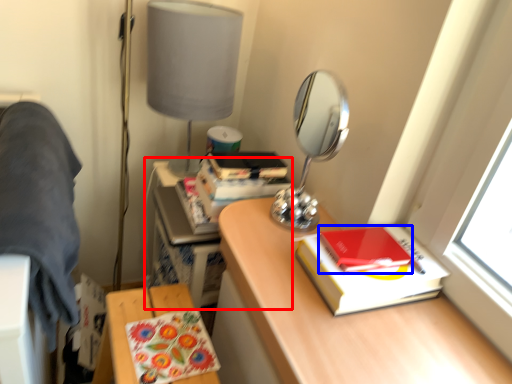
Question: Which object appears farthest to the camera in this image, computer desk (highlighted by a red box) or notebook (highlighted by a blue box)?

Choices:
 (A) computer desk
 (B) notebook

Answer: (A)